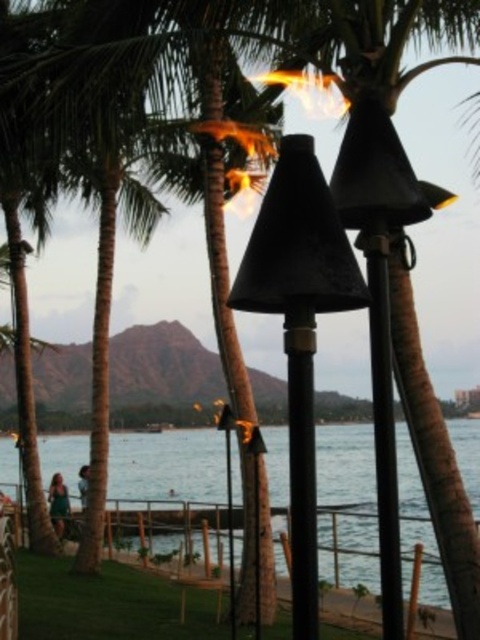
Is clear blue water at lower center bigger than black matte tiki torch at center?

Yes.

Who is positioned more to the right, clear blue water at lower center or black matte tiki torch at center?

From the viewer's perspective, clear blue water at lower center appears more on the right side.

Who is more distant from viewer, (x=350, y=454) or (x=334, y=209)?

The point (x=350, y=454) is more distant.

Find the location of a particular element. The image size is (480, 640). clear blue water at lower center is located at coordinates (168, 465).

Which is below, black matte pole at center or black metal pole at center?

black matte pole at center is lower down.

Is black matte pole at center bigger than black metal pole at center?

Incorrect, black matte pole at center is not larger than black metal pole at center.

The image size is (480, 640). In order to click on black matte pole at center in this screenshot , I will do `click(301, 468)`.

Where is `black matte pole at center`? black matte pole at center is located at coordinates (301, 468).

Is point (298, 422) more distant than point (312, 481)?

Yes, it is behind point (312, 481).

Between black matte tiki torch at center and black matte pole at center, which one is positioned higher?

Positioned higher is black matte tiki torch at center.

Is point (303, 458) positioned in front of point (311, 356)?

Yes, point (303, 458) is closer to viewer.

Find the location of a particular element. The height and width of the screenshot is (640, 480). black matte tiki torch at center is located at coordinates (300, 324).